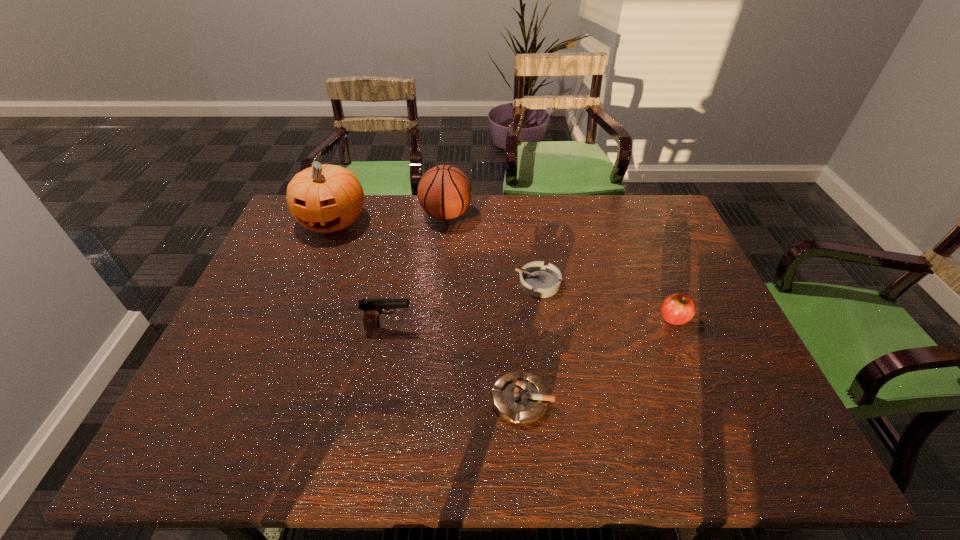
Where is `free space that satisfies the following two spatial constraints: 1. on the front side of the farther ashtray; 2. at the barrel of the fourth shortest object`? Image resolution: width=960 pixels, height=540 pixels. free space that satisfies the following two spatial constraints: 1. on the front side of the farther ashtray; 2. at the barrel of the fourth shortest object is located at coordinates (543, 326).

Locate an element on the screen. This screenshot has width=960, height=540. free space that satisfies the following two spatial constraints: 1. on the side where the inflation valve is located; 2. on the left side of the basketball is located at coordinates (429, 400).

What are the coordinates of `free location that satisfies the following two spatial constraints: 1. on the front-facing side of the third farthest object; 2. on the left side of the pumpkin` in the screenshot? It's located at (307, 284).

You are a GUI agent. You are given a task and a screenshot of the screen. Output one action in this format:
    pyautogui.click(x=<x>, y=<y>)
    Task: Click on the vacant space that satisfies the following two spatial constraints: 1. on the side where the inflation valve is located; 2. on the right side of the apple
    The width and height of the screenshot is (960, 540).
    Given the screenshot: What is the action you would take?
    pyautogui.click(x=437, y=318)

Image resolution: width=960 pixels, height=540 pixels. I want to click on vacant space that satisfies the following two spatial constraints: 1. on the front side of the fourth tallest object; 2. at the barrel of the pistol, so click(677, 326).

You are a GUI agent. You are given a task and a screenshot of the screen. Output one action in this format:
    pyautogui.click(x=<x>, y=<y>)
    Task: Click on the free spot that satisfies the following two spatial constraints: 1. on the side where the inflation valve is located; 2. on the right side of the nearer ashtray
    Image resolution: width=960 pixels, height=540 pixels.
    Given the screenshot: What is the action you would take?
    pyautogui.click(x=429, y=400)